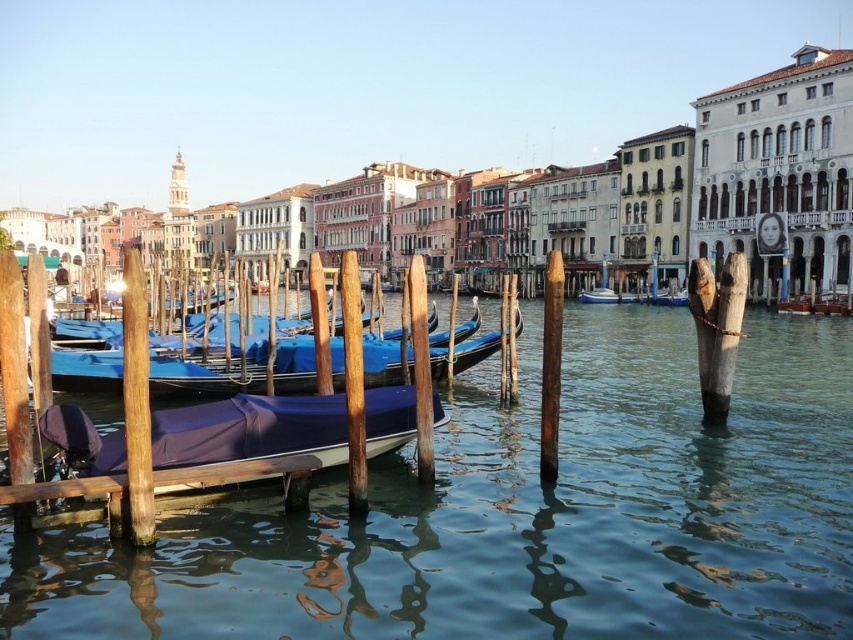
You are standing on the brown wooden dock at lower left and want to board the blue glossy boat at center. Which direction should you move to reach the boat?

The brown wooden dock at lower left is located below the blue glossy boat at center, so you should move upward to reach the boat.